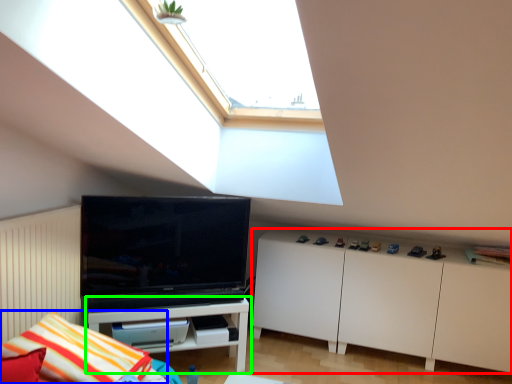
Question: Which object is positioned closest to cabinetry (highlighted by a red box)? Select from pillow (highlighted by a blue box) and shelf (highlighted by a green box).

Choices:
 (A) pillow
 (B) shelf

Answer: (B)